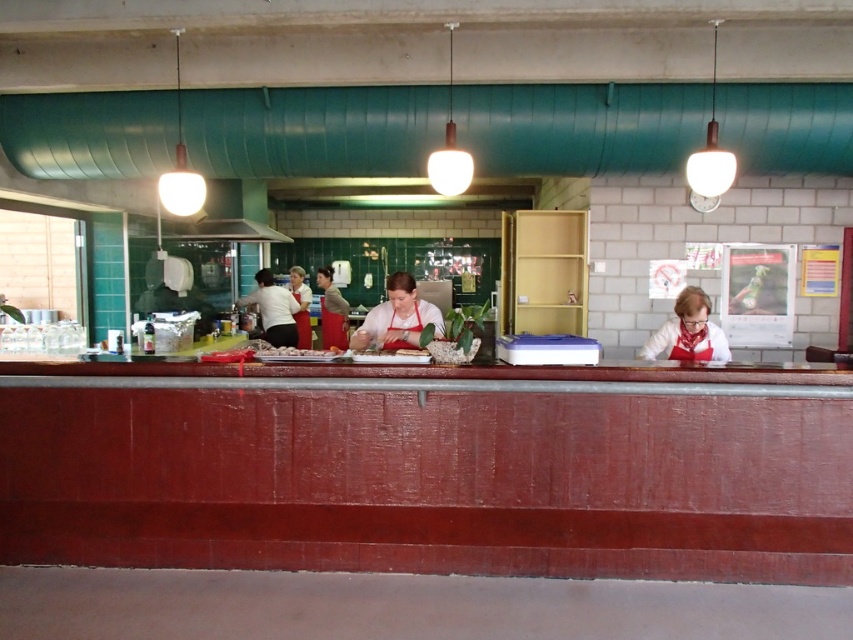
Question: Can you confirm if smooth red wood counter at center is wider than matte white apron at center?

Choices:
 (A) yes
 (B) no

Answer: (A)

Question: Among these points, which one is nearest to the camera?

Choices:
 (A) (277, 353)
 (B) (80, 500)

Answer: (B)

Question: Which of the following is the closest to the observer?

Choices:
 (A) red matte apron at center
 (B) white glossy apron at center
 (C) white apron at center

Answer: (A)

Question: Is red matte apron at center positioned at the back of matte white apron at center?

Choices:
 (A) yes
 (B) no

Answer: (B)

Question: Does smooth red wood counter at center have a greater width compared to white glossy apron at center?

Choices:
 (A) yes
 (B) no

Answer: (A)

Question: Which of the following is the farthest from the observer?

Choices:
 (A) smooth red wood counter at center
 (B) matte beige apron at center
 (C) white apron at center

Answer: (B)